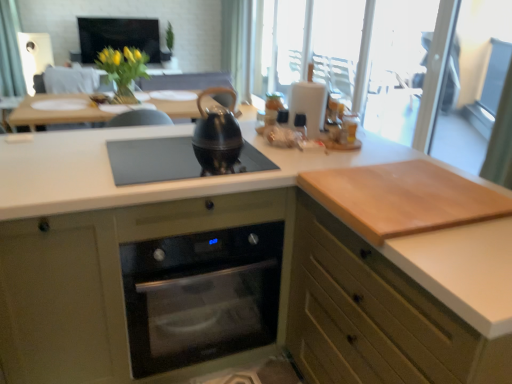
The width and height of the screenshot is (512, 384). Identify the location of free spot in front of black matte kettle at center. (213, 158).